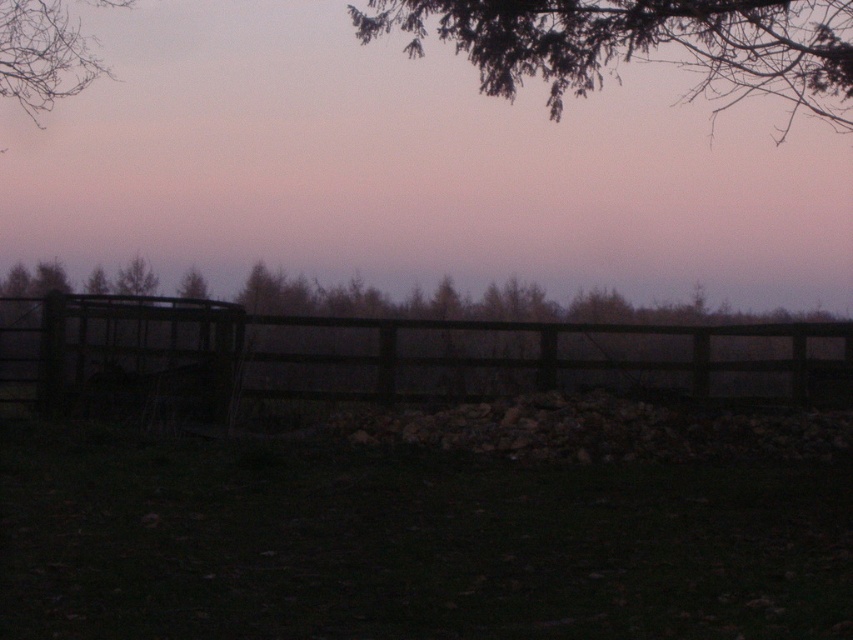
You are standing at the edge of the field looking at the dark brown wooden fence at center and the bare branches at upper left. How far apart are these two objects?

The dark brown wooden fence at center is 10.75 meters from the bare branches at upper left.

You are a painter setting up your easel to capture the rural scene. You want to ensure that the dark brown wooden fence at center and the bare branches at upper left are both visible in your painting. Based on their positions, which object will appear closer to the top of your canvas?

The bare branches at upper left will appear closer to the top of the canvas because the dark brown wooden fence at center is positioned under them.

You are an artist setting up your easel in the field. You want to paint the dark brown wooden fence at center and the green leafy branch at upper center. Which object should you focus on first if you want to paint the larger one first?

The green leafy branch at upper center is larger than the dark brown wooden fence at center, so you should focus on painting the green leafy branch at upper center first.